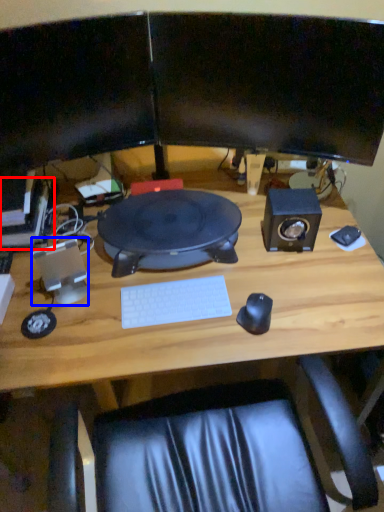
Question: Which point is closer to the camera, computer (highlighted by a red box) or speaker (highlighted by a blue box)?

Choices:
 (A) computer
 (B) speaker

Answer: (B)